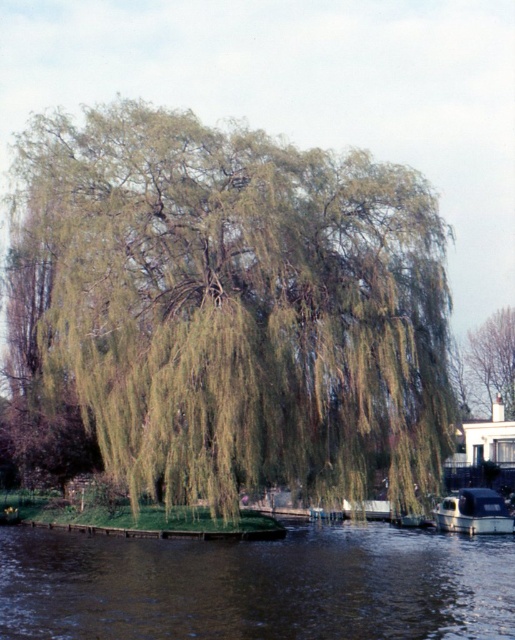
Question: Which of these objects is positioned closest to the brown water at lower center?

Choices:
 (A) shiny black boat at lower right
 (B) green leafy willow at center

Answer: (B)

Question: Which object is the farthest from the brown water at lower center?

Choices:
 (A) green leafy tree at upper right
 (B) green leafy willow at center

Answer: (A)

Question: Among these objects, which one is farthest from the camera?

Choices:
 (A) brown water at lower center
 (B) green leafy willow at center

Answer: (B)

Question: Can you confirm if green leafy willow at center is positioned to the right of shiny black boat at lower right?

Choices:
 (A) yes
 (B) no

Answer: (B)

Question: From the image, what is the correct spatial relationship of green leafy willow at center in relation to brown water at lower center?

Choices:
 (A) right
 (B) left

Answer: (B)

Question: Does brown water at lower center have a larger size compared to shiny black boat at lower right?

Choices:
 (A) no
 (B) yes

Answer: (B)